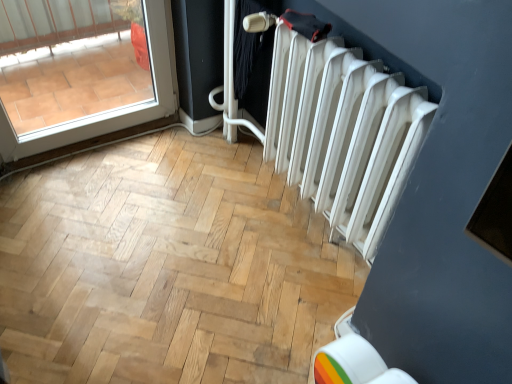
Question: Does white matte radiator at right have a lesser width compared to transparent glass door at upper left?

Choices:
 (A) no
 (B) yes

Answer: (A)

Question: Does white matte radiator at right have a greater width compared to transparent glass door at upper left?

Choices:
 (A) no
 (B) yes

Answer: (B)

Question: Is white matte radiator at right in contact with transparent glass door at upper left?

Choices:
 (A) no
 (B) yes

Answer: (A)

Question: Is white matte radiator at right oriented towards transparent glass door at upper left?

Choices:
 (A) yes
 (B) no

Answer: (B)

Question: Is white matte radiator at right further to camera compared to transparent glass door at upper left?

Choices:
 (A) yes
 (B) no

Answer: (B)

Question: Can you confirm if white matte radiator at right is positioned to the right of transparent glass door at upper left?

Choices:
 (A) no
 (B) yes

Answer: (B)

Question: From a real-world perspective, is transparent glass door at upper left physically above white matte radiator at right?

Choices:
 (A) no
 (B) yes

Answer: (A)

Question: Would you say transparent glass door at upper left is a long distance from white matte radiator at right?

Choices:
 (A) yes
 (B) no

Answer: (B)

Question: Is transparent glass door at upper left taller than white matte radiator at right?

Choices:
 (A) no
 (B) yes

Answer: (A)

Question: From a real-world perspective, is transparent glass door at upper left positioned under white matte radiator at right based on gravity?

Choices:
 (A) no
 (B) yes

Answer: (B)

Question: Considering the relative positions of transparent glass door at upper left and white matte radiator at right in the image provided, is transparent glass door at upper left to the right of white matte radiator at right from the viewer's perspective?

Choices:
 (A) yes
 (B) no

Answer: (B)

Question: Does transparent glass door at upper left have a lesser width compared to white matte radiator at right?

Choices:
 (A) yes
 (B) no

Answer: (A)

Question: From a real-world perspective, is transparent glass door at upper left positioned above or below white matte radiator at right?

Choices:
 (A) below
 (B) above

Answer: (A)